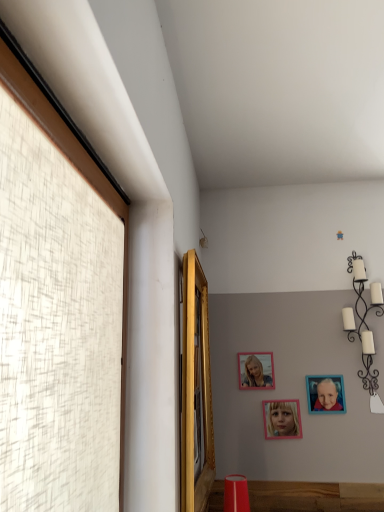
Question: Are white matte candle holder at upper right, the second lamp viewed from the left, and gold wooden mirror at upper left, which is the first window in back-to-front order, beside each other?

Choices:
 (A) no
 (B) yes

Answer: (A)

Question: Does white matte candle holder at upper right, the second lamp viewed from the left, lie behind gold wooden mirror at upper left, which ranks as the first window in right-to-left order?

Choices:
 (A) yes
 (B) no

Answer: (A)

Question: Is white matte candle holder at upper right, the 1th lamp when ordered from front to back, positioned with its back to gold wooden mirror at upper left, the 2th window positioned from the left?

Choices:
 (A) no
 (B) yes

Answer: (A)

Question: Is white matte candle holder at upper right, the 1th lamp when ordered from front to back, taller than gold wooden mirror at upper left, which is the first window in back-to-front order?

Choices:
 (A) yes
 (B) no

Answer: (B)

Question: Is gold wooden mirror at upper left, which ranks as the first window in right-to-left order, completely or partially inside white matte candle holder at upper right, the 1th lamp when ordered from front to back?

Choices:
 (A) yes
 (B) no

Answer: (B)

Question: Would you say white matte candle holder at upper right, the second lamp viewed from the left, is a long distance from gold wooden mirror at upper left, which is the first window in back-to-front order?

Choices:
 (A) no
 (B) yes

Answer: (B)

Question: Is blue matte picture frame at upper right, the 3th picture frame from the left, at the back of gold wooden mirror at upper left, the 2th window positioned from the left?

Choices:
 (A) no
 (B) yes

Answer: (A)

Question: From a real-world perspective, is gold wooden mirror at upper left, which is the first window in back-to-front order, on blue matte picture frame at upper right, the 3th picture frame from the left?

Choices:
 (A) yes
 (B) no

Answer: (A)

Question: From the image's perspective, is gold wooden mirror at upper left, which ranks as the first window in right-to-left order, over blue matte picture frame at upper right, the 3th picture frame from the left?

Choices:
 (A) yes
 (B) no

Answer: (A)

Question: Is gold wooden mirror at upper left, arranged as the second window when viewed from the front, oriented towards blue matte picture frame at upper right, marked as the 1th picture frame in a right-to-left arrangement?

Choices:
 (A) yes
 (B) no

Answer: (B)

Question: Is gold wooden mirror at upper left, arranged as the second window when viewed from the front, far away from blue matte picture frame at upper right, marked as the 1th picture frame in a right-to-left arrangement?

Choices:
 (A) no
 (B) yes

Answer: (B)

Question: Can you confirm if gold wooden mirror at upper left, which ranks as the first window in right-to-left order, is taller than blue matte picture frame at upper right, marked as the 1th picture frame in a right-to-left arrangement?

Choices:
 (A) no
 (B) yes

Answer: (B)

Question: Can you confirm if pink matte picture frame at upper center, which is counted as the 1th picture frame, starting from the left, is wider than pink matte picture frame at center, arranged as the 2th picture frame when viewed from the right?

Choices:
 (A) yes
 (B) no

Answer: (B)